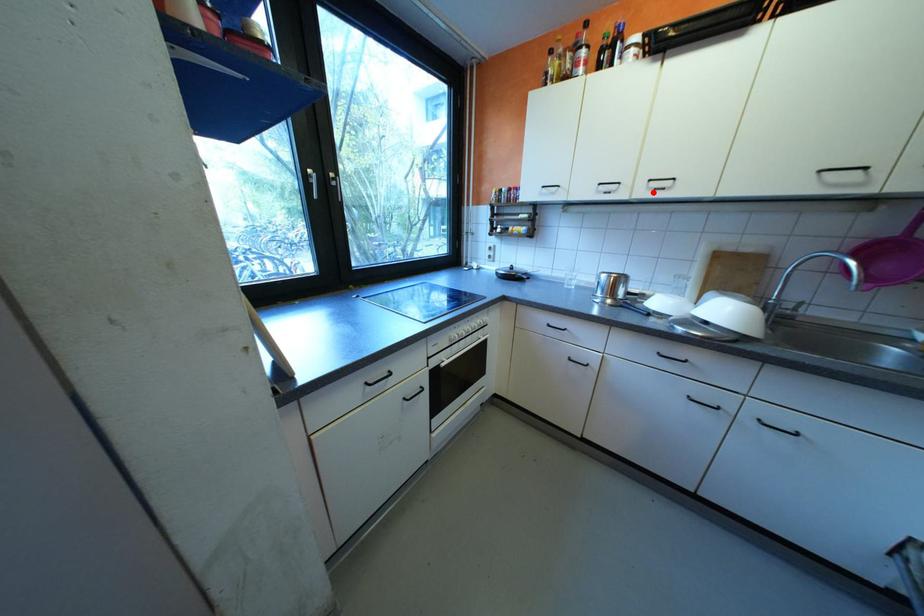
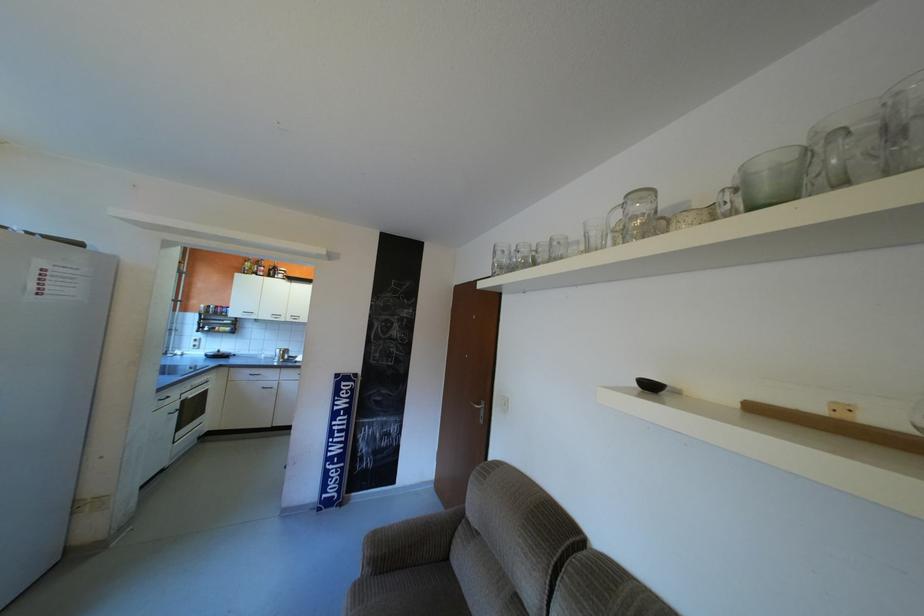
Where in the second image is the point corresponding to the highlighted location from the first image?

(300, 318)